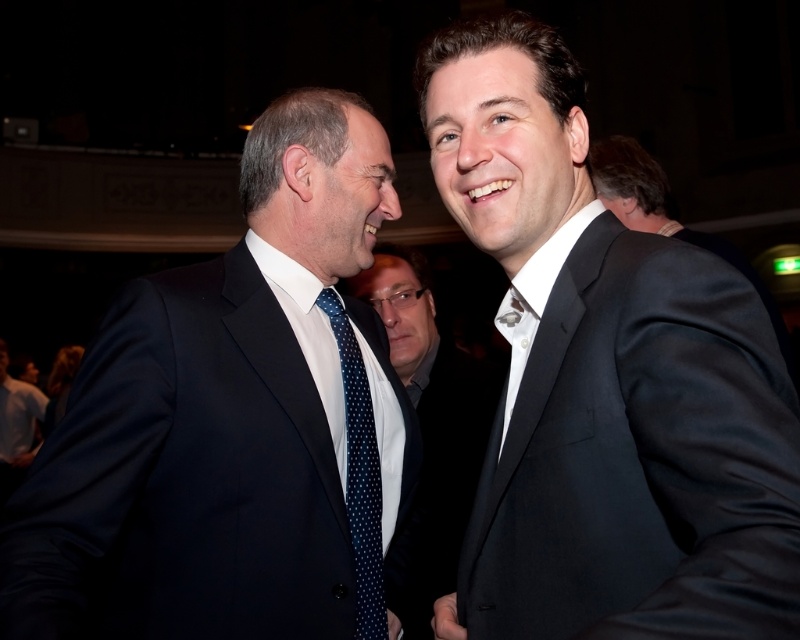
Question: Which point is farther to the camera?

Choices:
 (A) (148, 476)
 (B) (676, 518)
 (C) (376, 483)

Answer: (C)

Question: Can you confirm if blue dotted tie at center is thinner than matte black suit at lower left?

Choices:
 (A) yes
 (B) no

Answer: (B)

Question: Is matte black suit at left wider than blue dotted tie at center?

Choices:
 (A) no
 (B) yes

Answer: (B)

Question: Does polka dot tie at center appear under matte black suit at lower left?

Choices:
 (A) no
 (B) yes

Answer: (A)

Question: Among these objects, which one is farthest from the camera?

Choices:
 (A) polka dot tie at center
 (B) blue dotted tie at center

Answer: (A)

Question: Among these points, which one is nearest to the camera?

Choices:
 (A) (422, 449)
 (B) (26, 417)

Answer: (A)